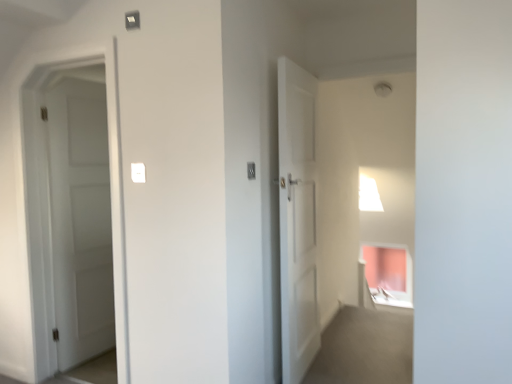
Question: From a real-world perspective, is white plastic light switch at center, the second light switch when ordered from right to left, under white matte door at left?

Choices:
 (A) yes
 (B) no

Answer: (B)

Question: Is white plastic light switch at center, the second light switch when ordered from right to left, bigger than white matte door at left?

Choices:
 (A) no
 (B) yes

Answer: (A)

Question: Can you confirm if white plastic light switch at center, the second light switch when ordered from right to left, is wider than white matte door at left?

Choices:
 (A) yes
 (B) no

Answer: (B)

Question: Is white plastic light switch at center, the second light switch when ordered from right to left, touching white matte door at left?

Choices:
 (A) no
 (B) yes

Answer: (A)

Question: Can you confirm if white plastic light switch at center, the 1th light switch positioned from the left, is positioned to the left of white matte door at left?

Choices:
 (A) no
 (B) yes

Answer: (A)

Question: Could white matte door at left be considered to be inside white plastic light switch at center, the second light switch when ordered from right to left?

Choices:
 (A) yes
 (B) no

Answer: (B)

Question: From the image's perspective, does white plastic light switch at center, marked as the 1th light switch in a right-to-left arrangement, appear lower than white plastic light switch at center, the 1th light switch positioned from the left?

Choices:
 (A) no
 (B) yes

Answer: (A)

Question: Does white plastic light switch at center, marked as the 1th light switch in a right-to-left arrangement, have a larger size compared to white plastic light switch at center, the 1th light switch positioned from the left?

Choices:
 (A) no
 (B) yes

Answer: (B)

Question: Is white plastic light switch at center, the second light switch when ordered from left to right, looking in the opposite direction of white plastic light switch at center, the second light switch when ordered from right to left?

Choices:
 (A) yes
 (B) no

Answer: (A)

Question: Can you confirm if white plastic light switch at center, the second light switch when ordered from left to right, is positioned to the left of white plastic light switch at center, the 1th light switch positioned from the left?

Choices:
 (A) no
 (B) yes

Answer: (A)

Question: Does white plastic light switch at center, the second light switch when ordered from left to right, appear on the right side of white plastic light switch at center, the 1th light switch positioned from the left?

Choices:
 (A) yes
 (B) no

Answer: (A)

Question: Is white plastic light switch at center, marked as the 1th light switch in a right-to-left arrangement, outside of white plastic light switch at center, the second light switch when ordered from right to left?

Choices:
 (A) no
 (B) yes

Answer: (B)

Question: Does white matte door at left touch white plastic light switch at center, the second light switch when ordered from right to left?

Choices:
 (A) yes
 (B) no

Answer: (B)